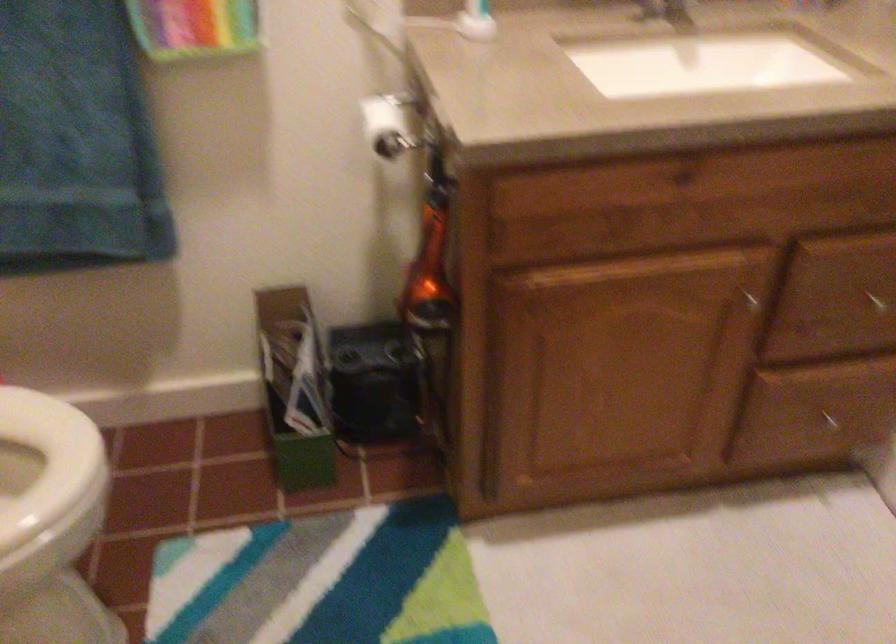
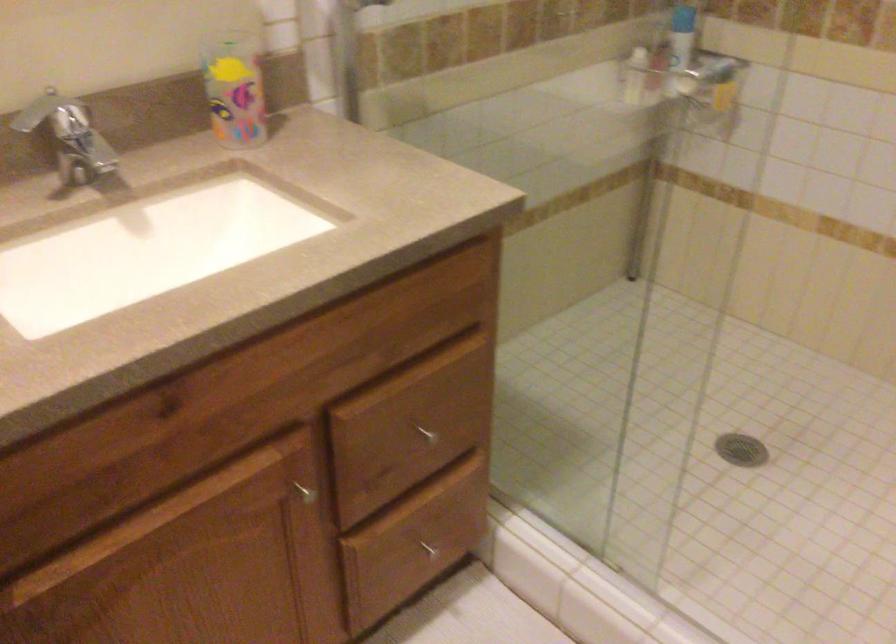
Question: The camera is either moving clockwise (left) or counter-clockwise (right) around the object. The first image is from the beginning of the video and the second image is from the end. Is the camera moving left or right when shooting the video?

Choices:
 (A) Left
 (B) Right

Answer: (A)